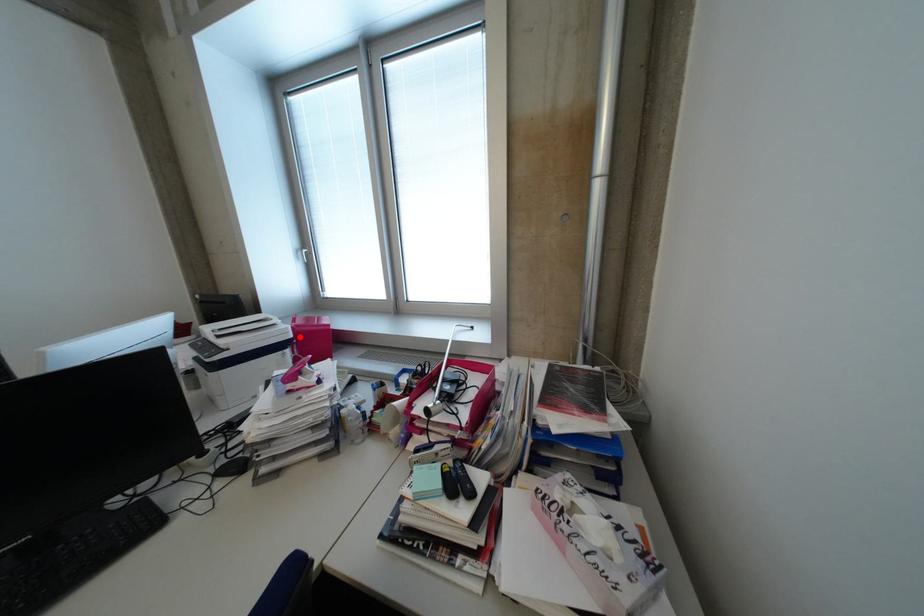
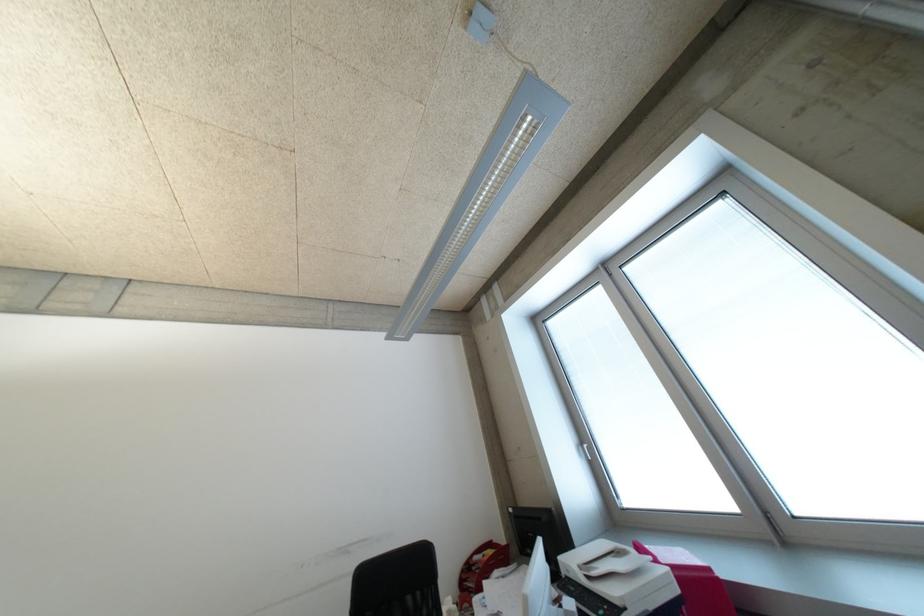
Find the pixel in the second image that matches the highlighted location in the first image.

(687, 591)